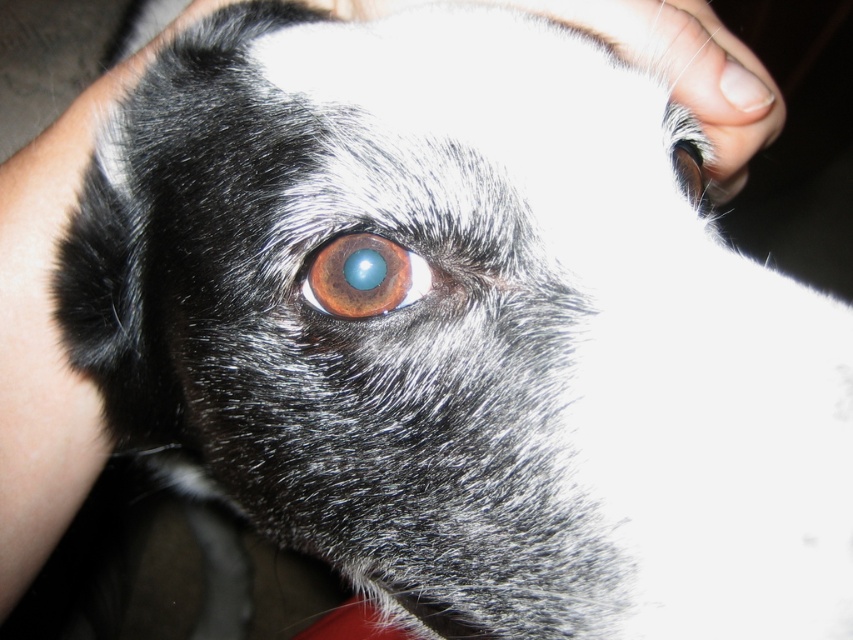
You are a photographer trying to capture the reflection in the brown glossy eye at center. Based on the scene, where should you adjust your camera focus to ensure the reflection is sharp?

The brown glossy eye at center is positioned at coordinates point (364, 276), so you should adjust your camera focus to that point to capture the reflection sharply.